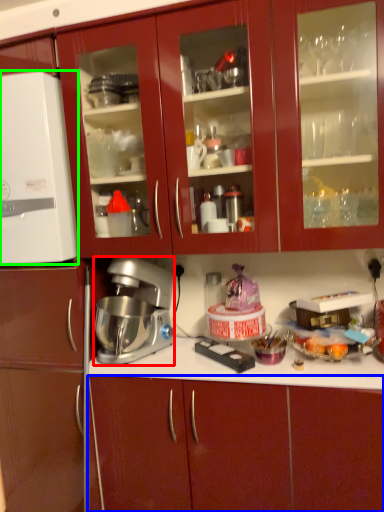
Question: Based on their relative distances, which object is nearer to mixer (highlighted by a red box)? Choose from cabinetry (highlighted by a blue box) and appliance (highlighted by a green box).

Choices:
 (A) cabinetry
 (B) appliance

Answer: (B)